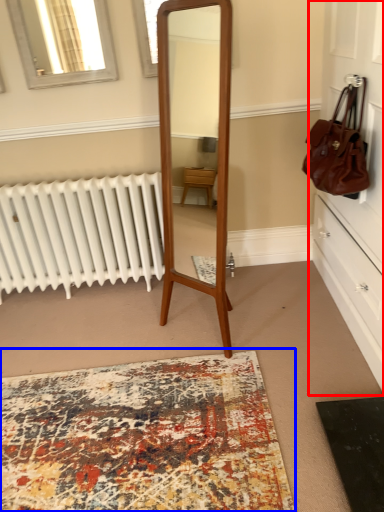
Question: Which point is further to the camera, dresser (highlighted by a red box) or mat (highlighted by a blue box)?

Choices:
 (A) dresser
 (B) mat

Answer: (B)